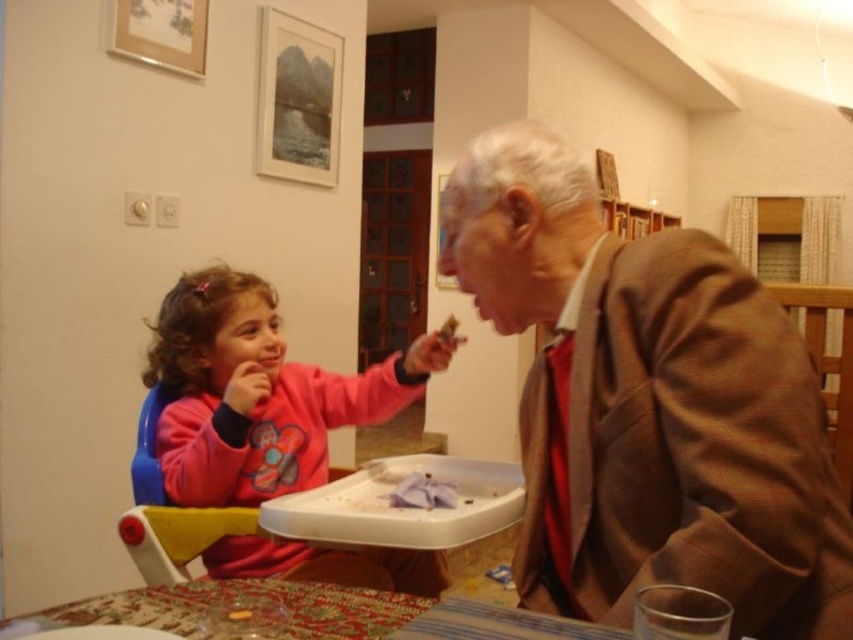
Who is lower down, brown textured suit at right or white crumb at upper center?

brown textured suit at right

Is point (540, 310) more distant than point (450, 317)?

That is False.

Find the location of a particular element. Image resolution: width=853 pixels, height=640 pixels. brown textured suit at right is located at coordinates [x=648, y=404].

Find the location of `brown textured suit at right`. brown textured suit at right is located at coordinates (648, 404).

Between point (614, 438) and point (288, 604), which one is positioned in front?

Point (288, 604) is more forward.

Between point (569, 522) and point (556, 632), which one is positioned behind?

Positioned behind is point (569, 522).

You are a GUI agent. You are given a task and a screenshot of the screen. Output one action in this format:
    pyautogui.click(x=<x>, y=<y>)
    Task: Click on the brown textured suit at right
    
    Given the screenshot: What is the action you would take?
    pyautogui.click(x=648, y=404)

Does point (399, 403) lie in front of point (61, 611)?

No, it is behind (61, 611).

Does pink fleece sweater at left have a smaller size compared to patterned fabric tablecloth at lower center?

No, pink fleece sweater at left is not smaller than patterned fabric tablecloth at lower center.

Which is in front, point (171, 310) or point (357, 602)?

Point (357, 602) is in front.

You are a GUI agent. You are given a task and a screenshot of the screen. Output one action in this format:
    pyautogui.click(x=<x>, y=<y>)
    Task: Click on the pink fleece sweater at left
    The width and height of the screenshot is (853, 640).
    Given the screenshot: What is the action you would take?
    pyautogui.click(x=257, y=394)